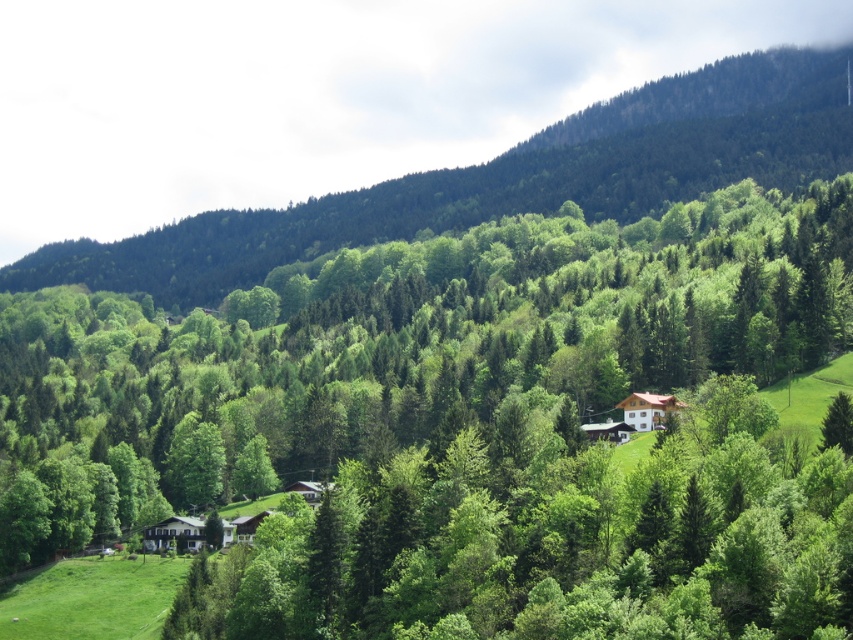
Question: Which is nearer to the green matte tree at center?

Choices:
 (A) green forested mountain at upper center
 (B) green leafy tree at center

Answer: (B)

Question: Which point is farther to the camera?

Choices:
 (A) green leafy tree at center
 (B) green forested mountain at upper center

Answer: (B)

Question: Is the position of green leafy tree at center less distant than that of green forested mountain at upper center?

Choices:
 (A) no
 (B) yes

Answer: (B)

Question: Does green leafy tree at center have a larger size compared to green forested mountain at upper center?

Choices:
 (A) yes
 (B) no

Answer: (B)

Question: Does green leafy tree at center appear under green matte tree at center?

Choices:
 (A) no
 (B) yes

Answer: (A)

Question: Which object is farther from the camera taking this photo?

Choices:
 (A) green leafy tree at center
 (B) green forested mountain at upper center
 (C) green matte tree at center

Answer: (B)